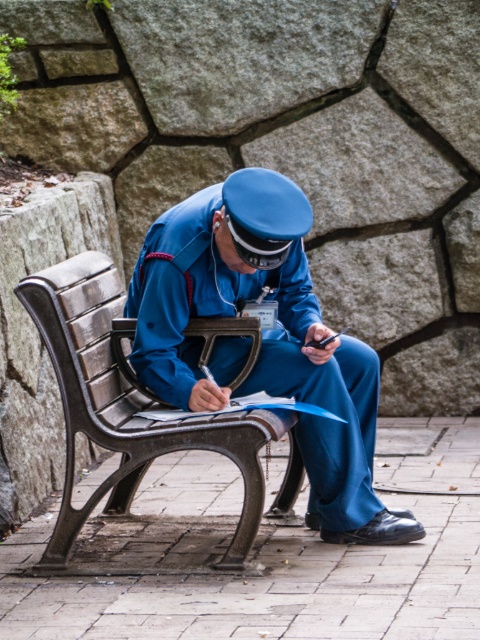
Which is behind, point (320, 380) or point (265, 422)?

Positioned behind is point (320, 380).

Which of these two, blue uniform at center or wooden bench at center, stands shorter?

wooden bench at center

Between point (309, 369) and point (255, 532), which one is positioned in front?

Positioned in front is point (255, 532).

Locate an element on the screen. blue uniform at center is located at coordinates (264, 340).